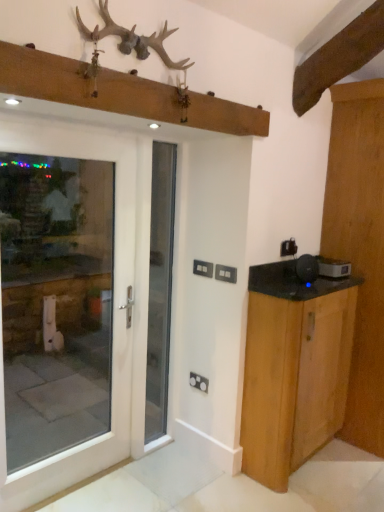
This screenshot has height=512, width=384. I want to click on free space in front of black plastic speaker at right, the 2th appliance in the right-to-left sequence, so click(x=302, y=292).